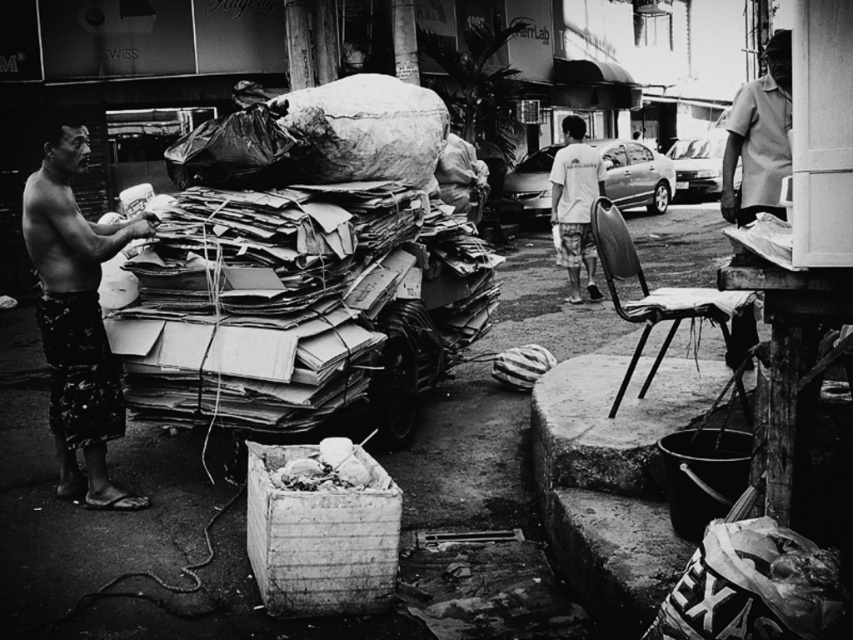
Question: Can you confirm if patterned fabric shorts at left is thinner than smooth gray shirt at upper right?

Choices:
 (A) no
 (B) yes

Answer: (B)

Question: Is patterned fabric shorts at left below white cotton shirt at center?

Choices:
 (A) no
 (B) yes

Answer: (B)

Question: Which point appears farthest from the camera in this image?

Choices:
 (A) (96, 483)
 (B) (741, 140)
 (C) (556, 212)

Answer: (C)

Question: Is smooth gray shirt at upper right closer to camera compared to white cotton shirt at center?

Choices:
 (A) yes
 (B) no

Answer: (A)

Question: Estimate the real-world distances between objects in this image. Which object is closer to the white cotton shirt at center?

Choices:
 (A) smooth gray shirt at upper right
 (B) patterned fabric shorts at left

Answer: (A)

Question: Which point is closer to the camera?

Choices:
 (A) patterned fabric shorts at left
 (B) white cotton shirt at center

Answer: (A)